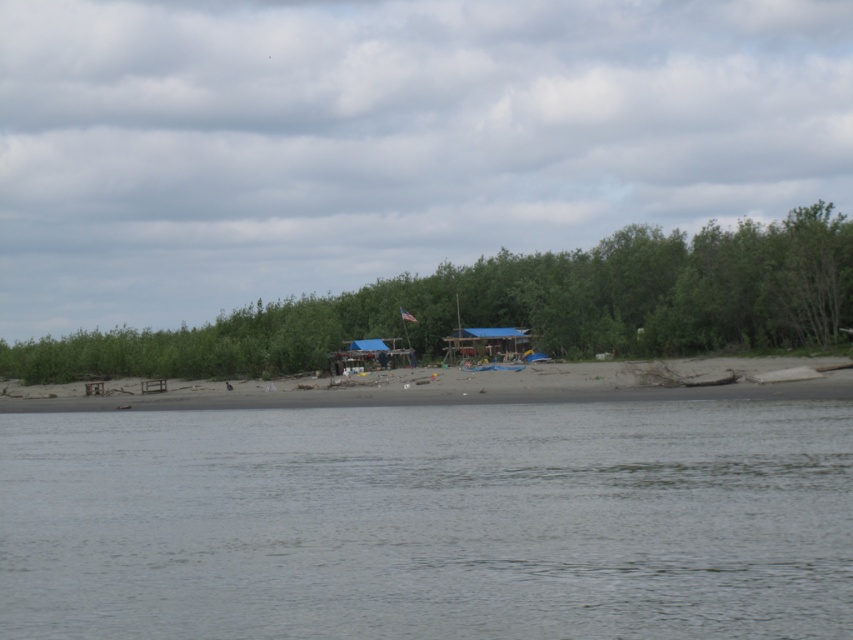
Question: Estimate the real-world distances between objects in this image. Which object is farther from the green leafy trees at center?

Choices:
 (A) beige sand beach at center
 (B) gray water at center

Answer: (B)

Question: Can you confirm if gray water at center is wider than beige sand beach at center?

Choices:
 (A) yes
 (B) no

Answer: (B)

Question: Is gray water at center positioned behind beige sand beach at center?

Choices:
 (A) no
 (B) yes

Answer: (A)

Question: Among these points, which one is farthest from the camera?

Choices:
 (A) (403, 586)
 (B) (305, 388)

Answer: (B)

Question: Is green leafy trees at center behind beige sand beach at center?

Choices:
 (A) no
 (B) yes

Answer: (B)

Question: Considering the real-world distances, which object is closest to the gray water at center?

Choices:
 (A) green leafy trees at center
 (B) beige sand beach at center

Answer: (B)